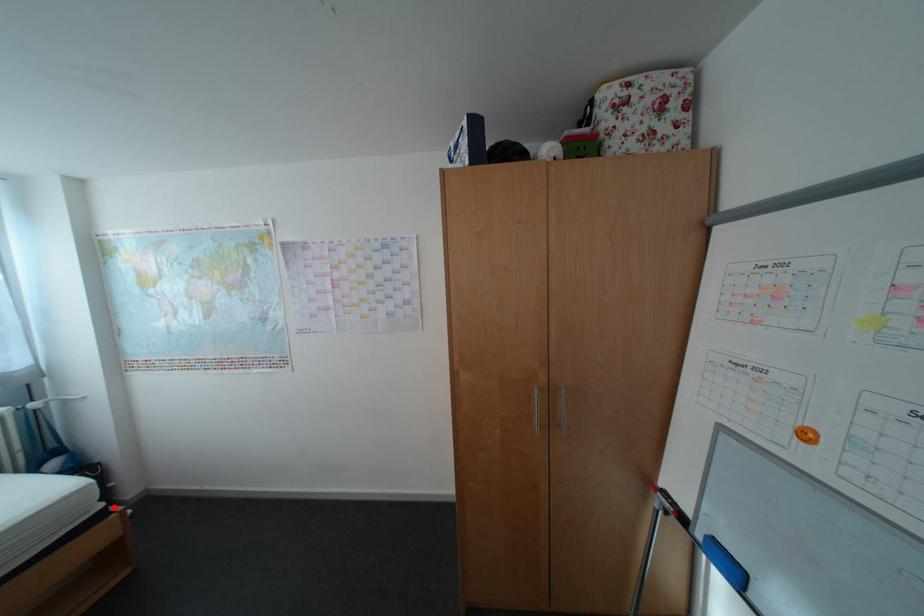
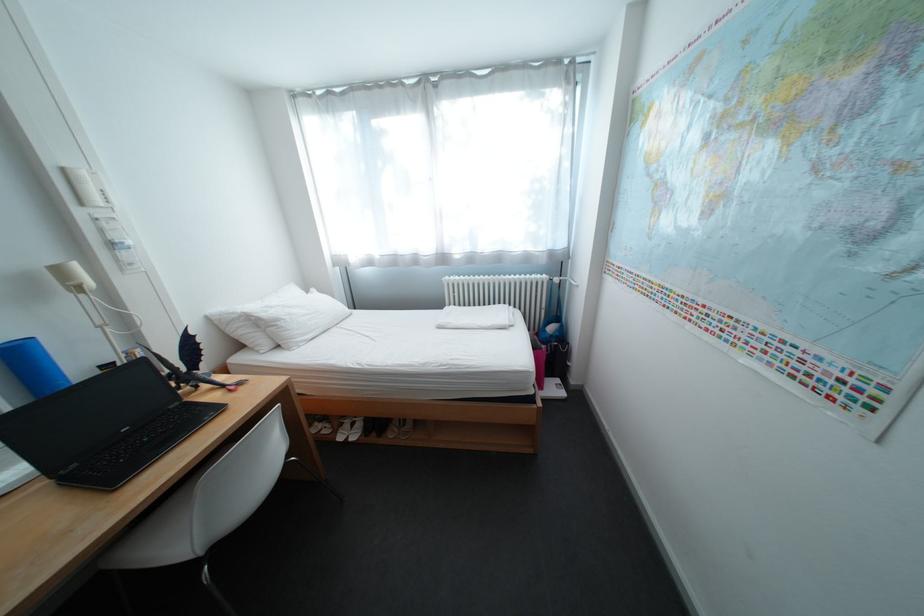
Where in the second image is the point corresponding to the highlighted location from the first image?

(544, 392)